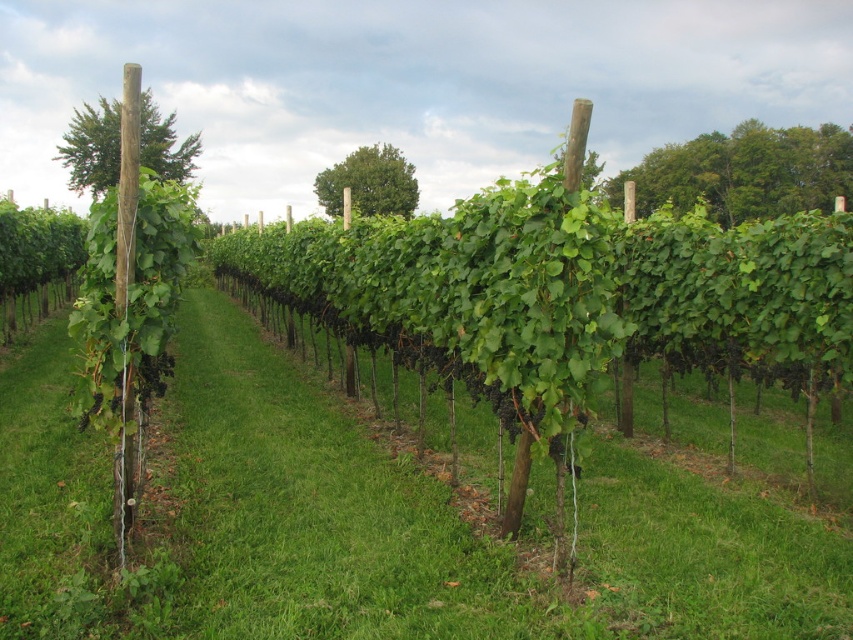
You are a drone operator flying a drone over the vineyard. You need to navigate between the green leafy tree at upper right and the green leafy tree at upper left. Which tree should you fly under to stay within the vineyard area?

The green leafy tree at upper right is positioned over the green leafy tree at upper left, so flying under the green leafy tree at upper right would keep you within the vineyard area as it is closer to the ground.

Consider the image. You are a bird flying over a vineyard and want to land on the tallest tree. Which tree should you choose between the green leafy tree at upper right and the green leafy tree at center?

The green leafy tree at upper right is much taller than the green leafy tree at center, so you should choose the green leafy tree at upper right to land on.